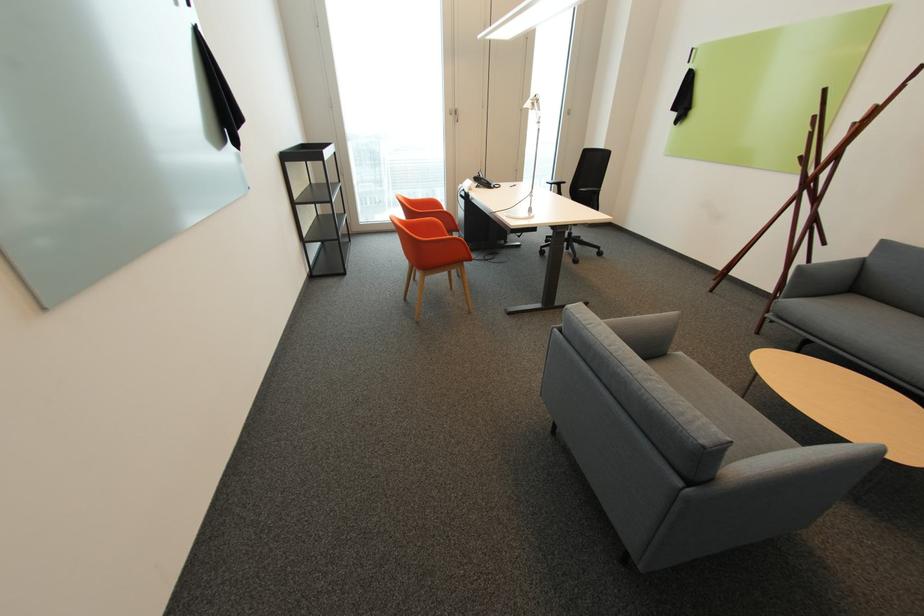
Where is `desk lamp head`? The height and width of the screenshot is (616, 924). desk lamp head is located at coordinates (532, 103).